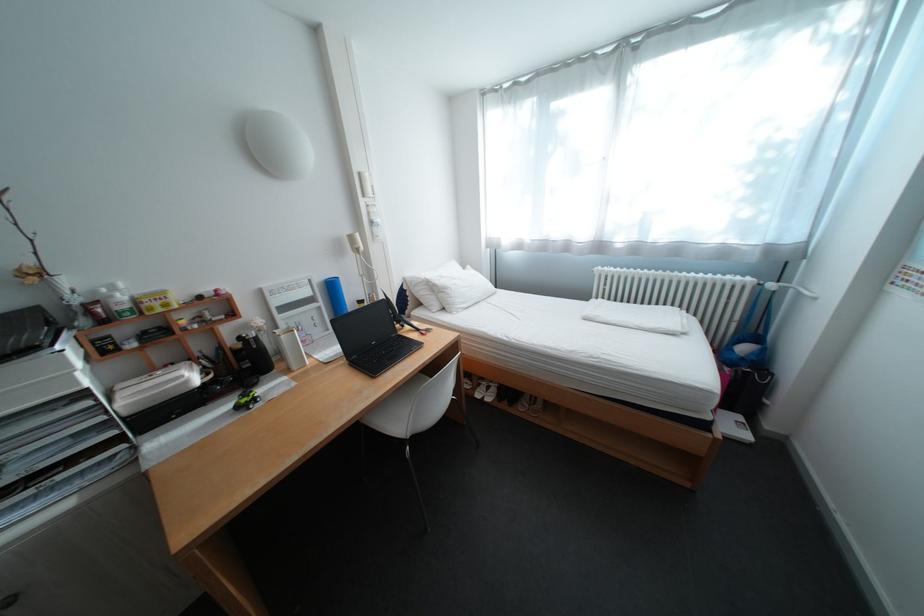
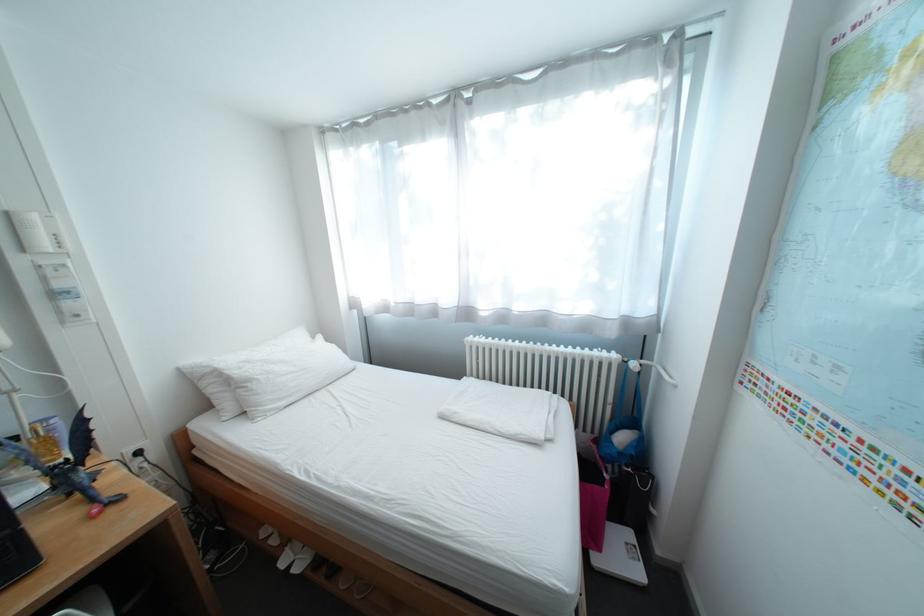
Question: The first image is from the beginning of the video and the second image is from the end. How did the camera likely rotate when shooting the video?

Choices:
 (A) Left
 (B) Right
 (C) Up
 (D) Down

Answer: (B)